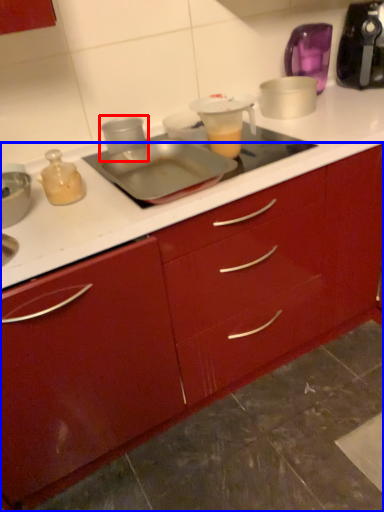
Question: Which point is closer to the camera, appliance (highlighted by a red box) or cabinetry (highlighted by a blue box)?

Choices:
 (A) appliance
 (B) cabinetry

Answer: (B)